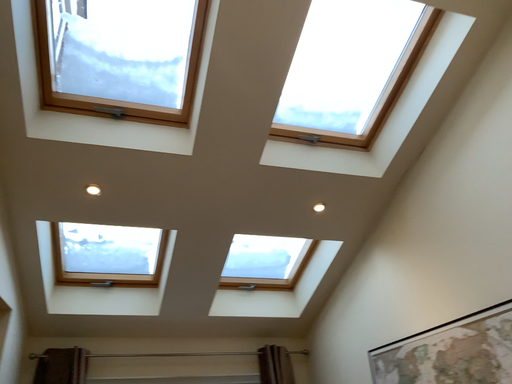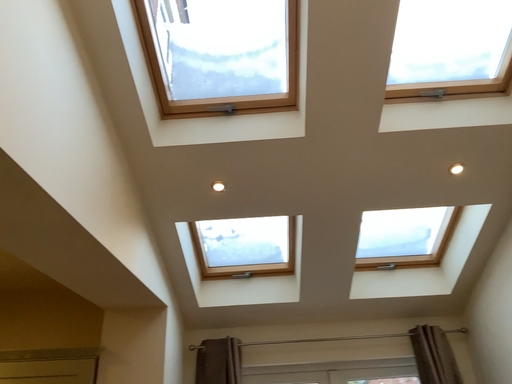
Question: How did the camera likely rotate when shooting the video?

Choices:
 (A) rotated right
 (B) rotated left

Answer: (B)